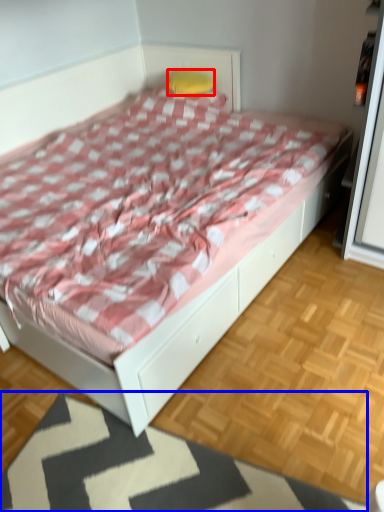
Question: Which point is closer to the camera, pillow (highlighted by a red box) or mat (highlighted by a blue box)?

Choices:
 (A) pillow
 (B) mat

Answer: (B)